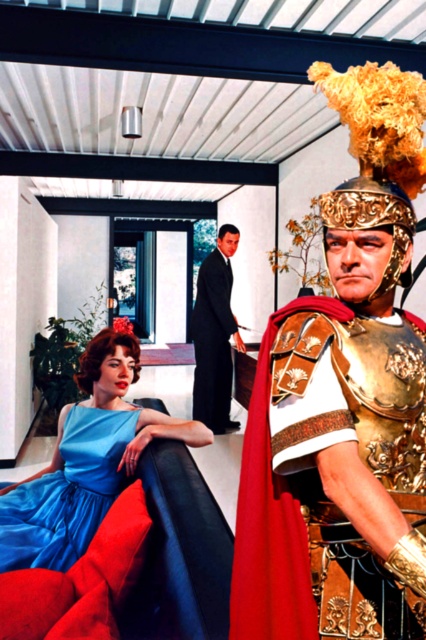
You are an interior designer working on a project that requires placing a large potted plant between the gold plated armor at center and the satin blue dress at lower left. Based on their positions, which object should the plant be closer to?

The gold plated armor at center is to the right of the satin blue dress at lower left, so the plant should be placed closer to the satin blue dress at lower left to maintain balance between the two objects.

You are an architect designing a new building that needs to incorporate elements from both Roman and modern design. You observe two key points in the image at coordinates point (264,506) and point (207,289). Which point should you prioritize in your design to ensure the Roman elements are visually dominant?

Point (264,506) should be prioritized because it is positioned in front of point (207,289), making it more prominent and thus ideal for emphasizing the Roman elements in the design.

You are a fashion designer observing the image. You need to determine which item is taller between the satin blue dress at center and the gold plated armor at center. Which one is taller?

The satin blue dress at center is taller than the gold plated armor at center according to the description.